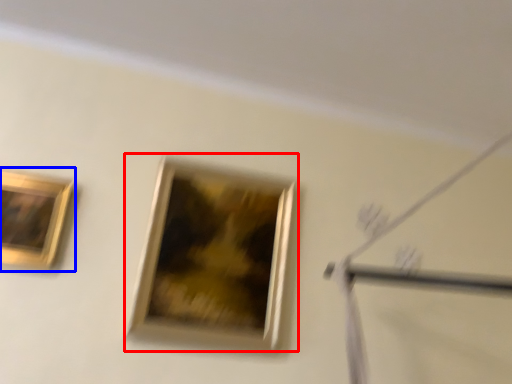
Question: Which object appears closest to the camera in this image, picture frame (highlighted by a red box) or picture frame (highlighted by a blue box)?

Choices:
 (A) picture frame
 (B) picture frame

Answer: (B)